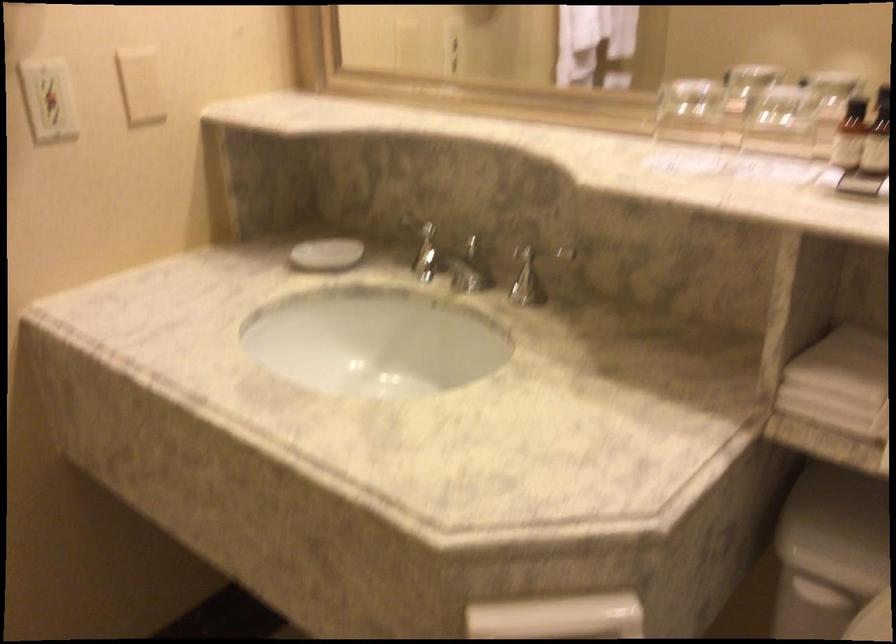
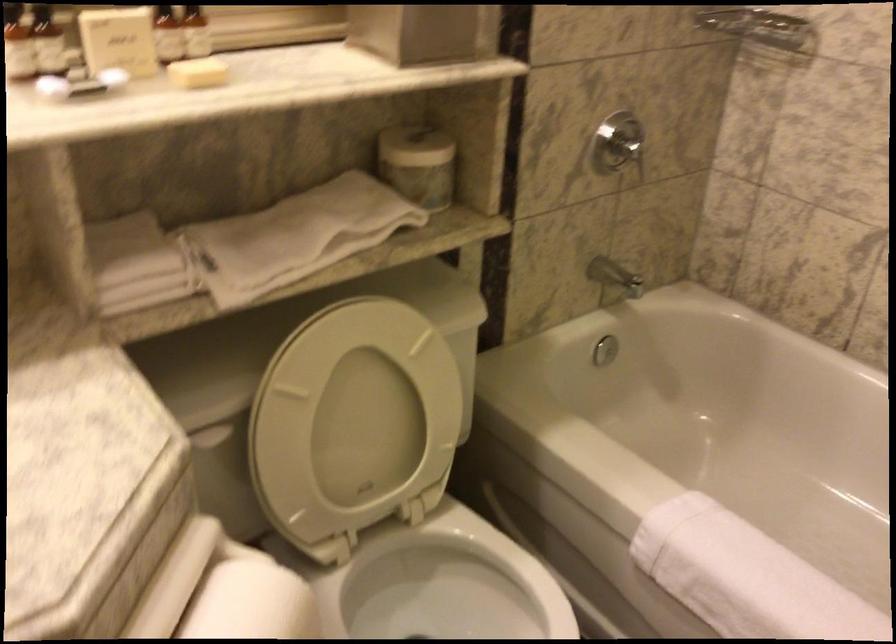
The images are taken continuously from a first-person perspective. In which direction is your viewpoint rotating?

The camera's rotation is toward right-down.